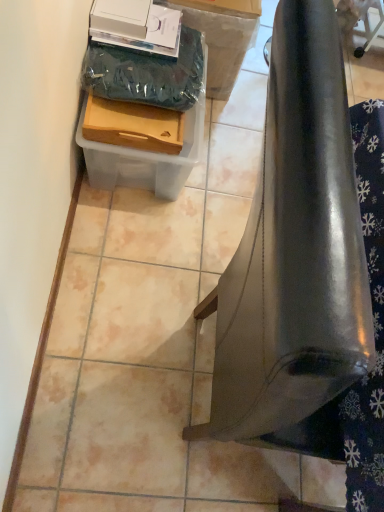
Question: Is wooden tray at lower left, the 2th box viewed from the back, completely or partially outside of glossy metallic bell at lower right?

Choices:
 (A) yes
 (B) no

Answer: (A)

Question: Is glossy metallic bell at lower right completely or partially inside wooden tray at lower left, the first box in the front-to-back sequence?

Choices:
 (A) yes
 (B) no

Answer: (B)

Question: Is the depth of wooden tray at lower left, the first box in the front-to-back sequence, greater than that of glossy metallic bell at lower right?

Choices:
 (A) no
 (B) yes

Answer: (B)

Question: Are wooden tray at lower left, the 2th box viewed from the back, and glossy metallic bell at lower right making contact?

Choices:
 (A) no
 (B) yes

Answer: (A)

Question: Can you confirm if wooden tray at lower left, the 2th box viewed from the back, is shorter than glossy metallic bell at lower right?

Choices:
 (A) yes
 (B) no

Answer: (A)

Question: Can you confirm if wooden tray at lower left, the 2th box viewed from the back, is taller than glossy metallic bell at lower right?

Choices:
 (A) no
 (B) yes

Answer: (A)

Question: Considering the relative positions of clear plastic container at lower left, placed as the 2th box when sorted from front to back, and glossy metallic bell at lower right in the image provided, is clear plastic container at lower left, placed as the 2th box when sorted from front to back, in front of glossy metallic bell at lower right?

Choices:
 (A) yes
 (B) no

Answer: (B)

Question: From a real-world perspective, does clear plastic container at lower left, arranged as the first box when viewed from the back, sit lower than glossy metallic bell at lower right?

Choices:
 (A) no
 (B) yes

Answer: (B)

Question: From the image's perspective, does clear plastic container at lower left, arranged as the first box when viewed from the back, appear lower than glossy metallic bell at lower right?

Choices:
 (A) yes
 (B) no

Answer: (B)

Question: Is clear plastic container at lower left, arranged as the first box when viewed from the back, to the left of glossy metallic bell at lower right from the viewer's perspective?

Choices:
 (A) no
 (B) yes

Answer: (B)

Question: Can you confirm if clear plastic container at lower left, placed as the 2th box when sorted from front to back, is smaller than glossy metallic bell at lower right?

Choices:
 (A) yes
 (B) no

Answer: (A)

Question: Does clear plastic container at lower left, placed as the 2th box when sorted from front to back, have a lesser height compared to glossy metallic bell at lower right?

Choices:
 (A) yes
 (B) no

Answer: (A)

Question: Is glossy metallic bell at lower right positioned beyond the bounds of wooden tray at lower left, the first box in the front-to-back sequence?

Choices:
 (A) yes
 (B) no

Answer: (A)